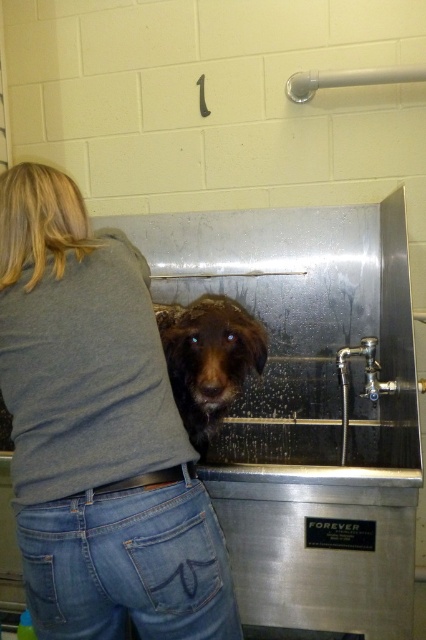
Does gray cotton shirt at center have a larger size compared to wet brown fur at center?

Yes, gray cotton shirt at center is bigger than wet brown fur at center.

Is gray cotton shirt at center further to the viewer compared to wet brown fur at center?

No, it is in front of wet brown fur at center.

Between point (63, 528) and point (238, 358), which one is positioned behind?

Positioned behind is point (238, 358).

Identify the location of gray cotton shirt at center. The width and height of the screenshot is (426, 640). (97, 433).